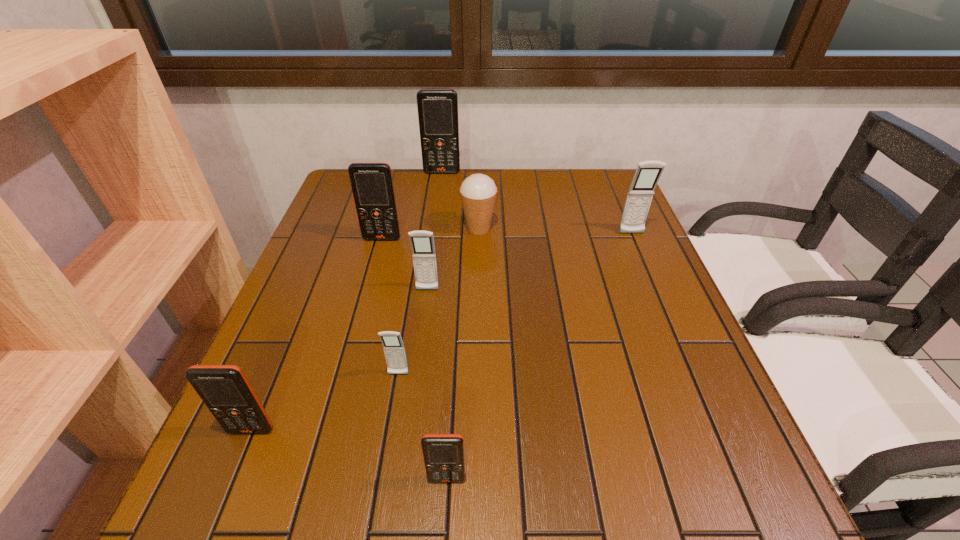
Identify the location of blank space located 0.150m on the right of the icecream. The width and height of the screenshot is (960, 540). (550, 229).

The image size is (960, 540). In order to click on free location located on the front-facing side of the smallest gray cellular telephone in this screenshot , I will do `click(380, 482)`.

Locate an element on the screen. object that is positioned at the far edge is located at coordinates (437, 108).

I want to click on object that is at the near edge, so point(443,454).

You are a GUI agent. You are given a task and a screenshot of the screen. Output one action in this format:
    pyautogui.click(x=<x>, y=<y>)
    Task: Click on the object at the right edge
    The image size is (960, 540).
    Given the screenshot: What is the action you would take?
    pyautogui.click(x=640, y=194)

Where is `vacant space at the far edge`? This screenshot has width=960, height=540. vacant space at the far edge is located at coordinates (466, 173).

I want to click on vacant position at the near edge of the desktop, so tap(537, 479).

Find the location of a particular element. The height and width of the screenshot is (540, 960). vacant space at the left edge is located at coordinates (335, 289).

The image size is (960, 540). I want to click on free space at the right edge, so click(x=636, y=349).

Image resolution: width=960 pixels, height=540 pixels. Find the location of `free space at the far left corner of the desktop`. free space at the far left corner of the desktop is located at coordinates (335, 202).